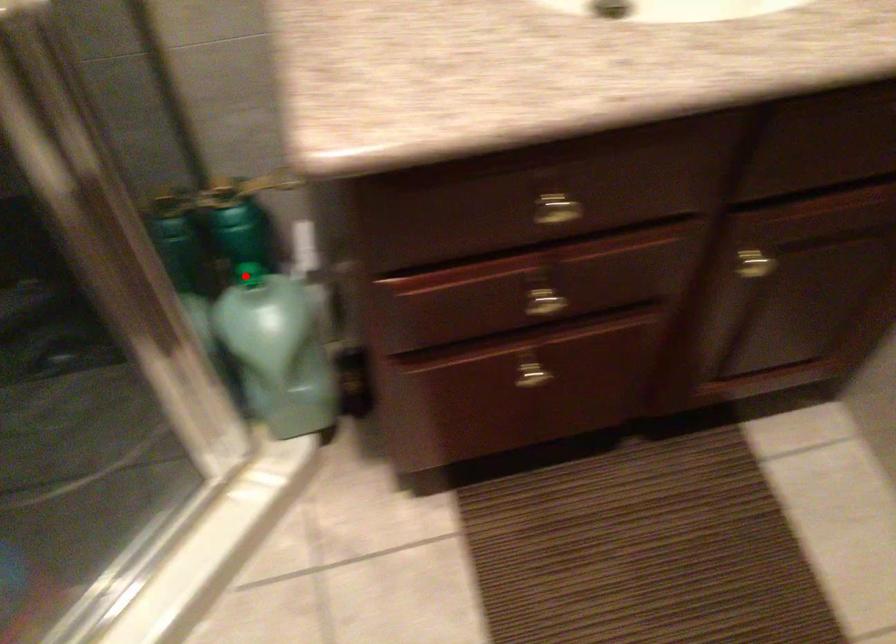
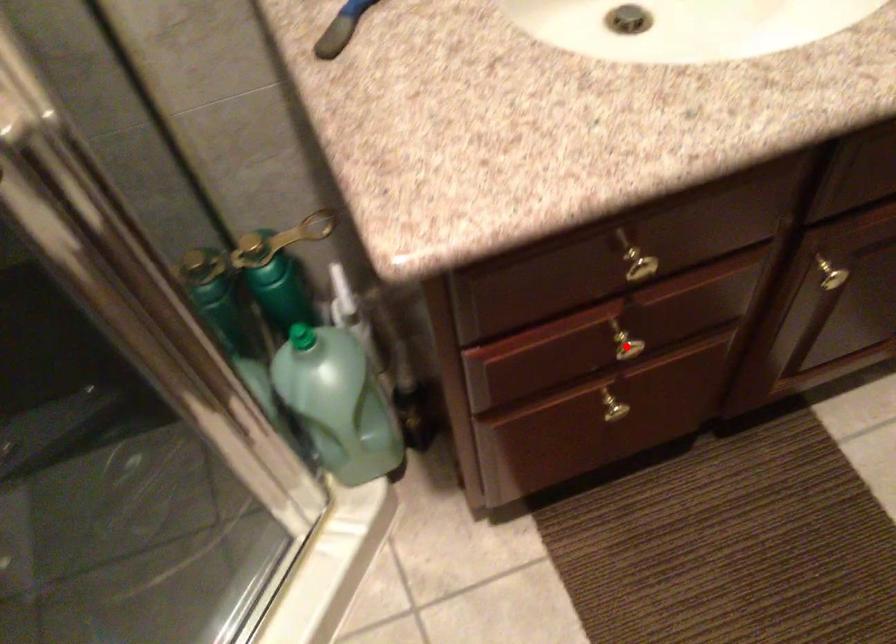
I am providing you with two images of the same scene from different viewpoints. A red point is marked on the first image and another point is marked on the second image. Are the points marked in image1 and image2 representing the same 3D position?

No